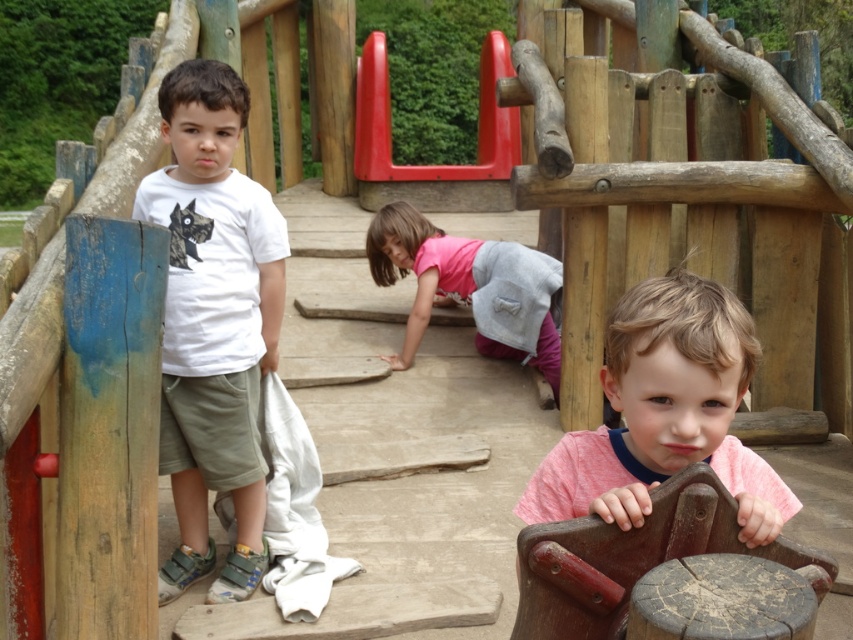
You are a photographer standing at the center of the playground. You want to take a photo of both point (590, 465) and point (531, 570). Which point should you focus on first to ensure both are in the frame?

You should focus on point (590, 465) first because it is closer to you than point (531, 570), ensuring both points are within the frame.

You are a parent at the playground and want to locate your child who is sitting on the pink fabric at center. You see the wooden log at center in the distance. Can you tell me which object is positioned to the right of the other?

The wooden log at center is positioned to the right of the pink fabric at center.

What are the coordinates of the wooden log at center?

The wooden log at center is located at coordinates point (x=628, y=557).